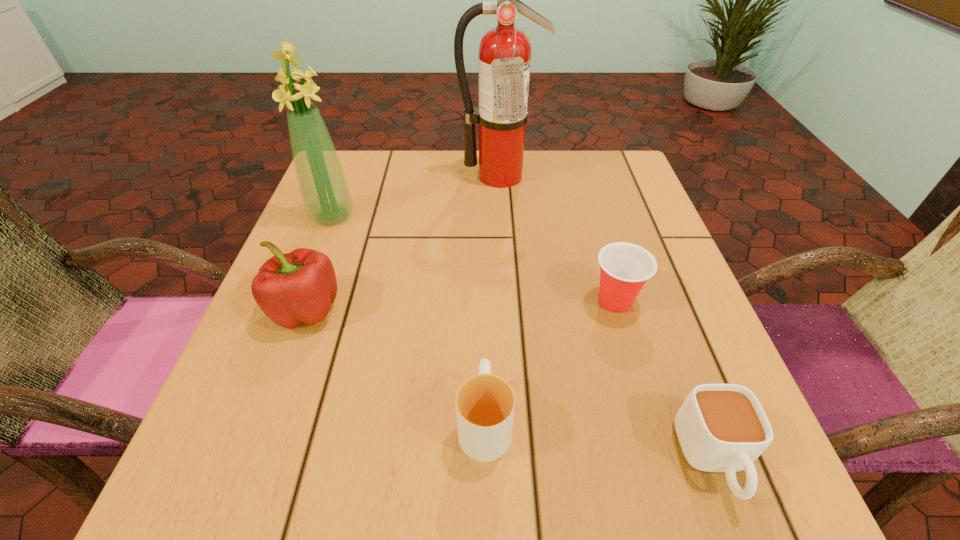
Identify the location of vacant area that lies between the leftmost cup and the fifth nearest object. (408, 319).

Identify the location of vacant area between the bell pepper and the farthest cup. click(461, 305).

This screenshot has height=540, width=960. I want to click on vacant space that's between the farthest cup and the bell pepper, so click(461, 305).

The width and height of the screenshot is (960, 540). Identify the location of the fourth closest object relative to the bouquet. (624, 267).

Identify which object is the closest to the farthest cup. Please provide its 2D coordinates. Your answer should be formatted as a tuple, i.e. [(x, y)], where the tuple contains the x and y coordinates of a point satisfying the conditions above.

[(721, 427)]

Point out which cup is positioned as the nearest to the fifth shortest object. Please provide its 2D coordinates. Your answer should be formatted as a tuple, i.e. [(x, y)], where the tuple contains the x and y coordinates of a point satisfying the conditions above.

[(485, 403)]

The width and height of the screenshot is (960, 540). Identify the location of cup that is the closest to the farthest cup. (721, 427).

Where is `free location that satisfies the following two spatial constraints: 1. on the nozzle side of the farthest cup; 2. on the right side of the tallest object`? This screenshot has width=960, height=540. free location that satisfies the following two spatial constraints: 1. on the nozzle side of the farthest cup; 2. on the right side of the tallest object is located at coordinates (506, 301).

Where is `free location that satisfies the following two spatial constraints: 1. with the handle on the side of the leftmost cup; 2. on the right side of the farthest cup`? free location that satisfies the following two spatial constraints: 1. with the handle on the side of the leftmost cup; 2. on the right side of the farthest cup is located at coordinates coord(484,301).